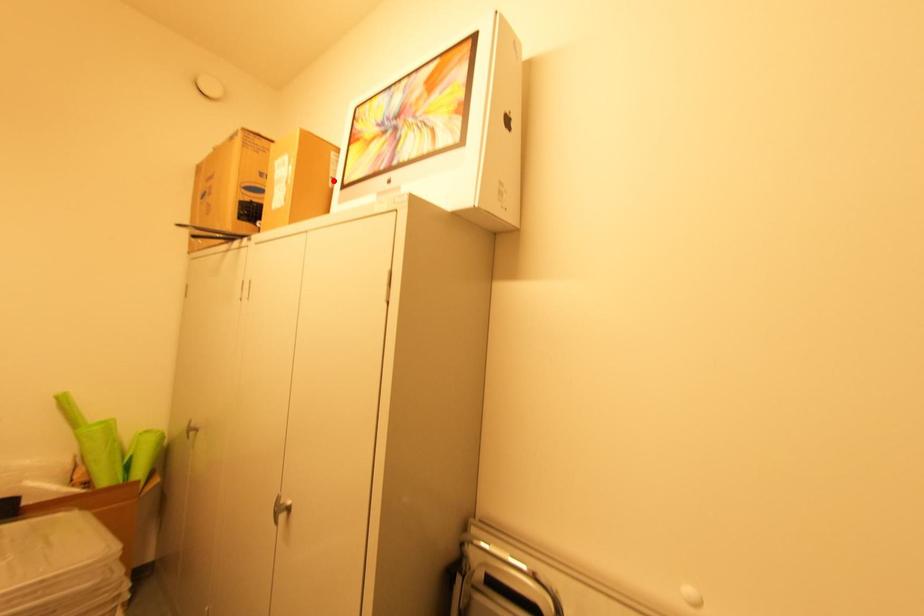
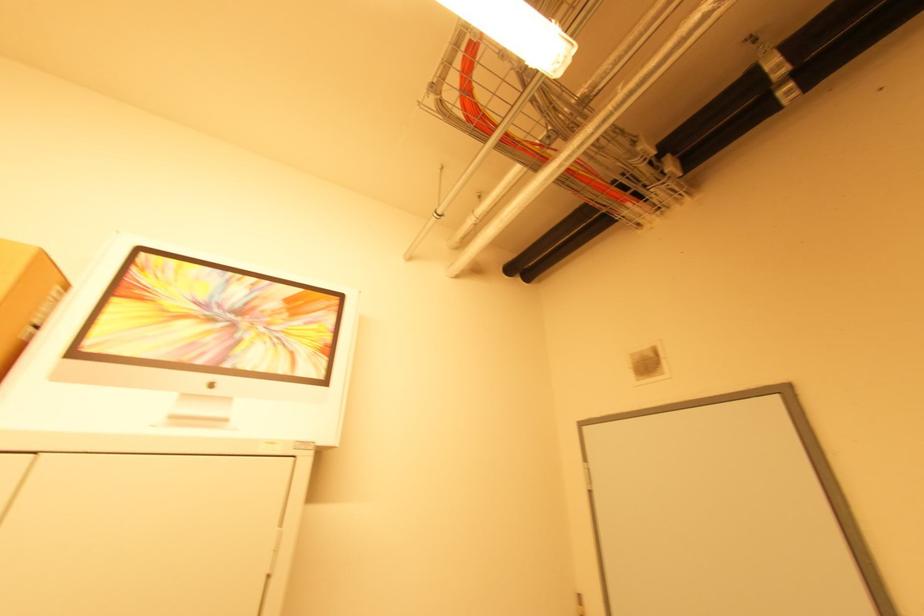
In the second image, find the point that corresponds to the highlighted location in the first image.

(32, 329)